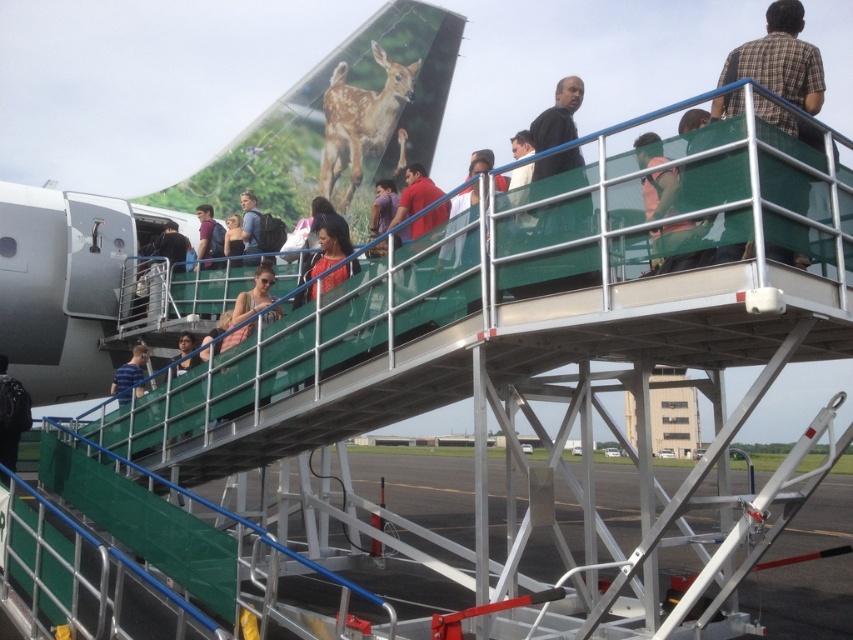
You are a passenger standing on the metallic gray tarmac at lower center and want to board the aircraft through the rear door. Can you see the black matte shirt at upper center from your current position?

The metallic gray tarmac at lower center is taller than the black matte shirt at upper center, so yes, you can see the black matte shirt at upper center from your position on the metallic gray tarmac at lower center because the tarmac is elevated above the shirt.

You are an airport staff member checking the boarding process. You notice two passengers wearing a matte red shirt at center and a blue striped shirt at center. Which passenger is wearing a smaller sized shirt?

The matte red shirt at center has a smaller size compared to the blue striped shirt at center, so the passenger wearing the matte red shirt at center has the smaller sized shirt.

You are a passenger at the airport and want to board the plane. You see the metallic gray tarmac at lower center and the blue striped shirt at center. Which object is located lower in the scene?

The metallic gray tarmac at lower center is located below the blue striped shirt at center, so it is lower in the scene.